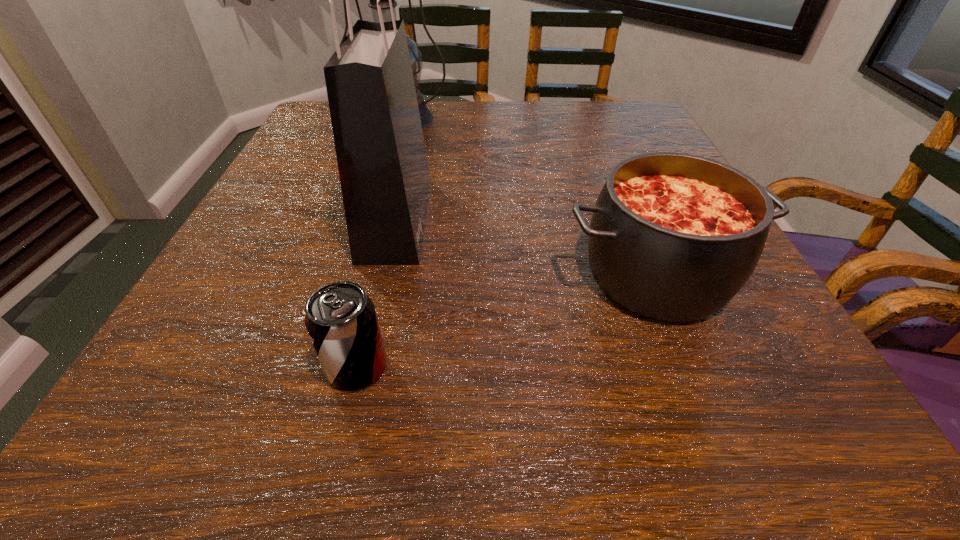
At what (x,y) coordinates should I click in order to perform the action: click on object that is at the far edge. Please return your answer as a coordinate pair (x, y). Image resolution: width=960 pixels, height=540 pixels. Looking at the image, I should click on (426, 116).

Identify the location of object that is at the near edge. This screenshot has width=960, height=540. (341, 320).

Identify the location of object at the left edge. (426, 116).

Where is `object that is at the right edge`? The image size is (960, 540). object that is at the right edge is located at coordinates (673, 236).

This screenshot has width=960, height=540. What are the coordinates of `object situated at the far left corner` in the screenshot? It's located at (426, 116).

This screenshot has width=960, height=540. I want to click on vacant space at the far edge of the desktop, so click(466, 118).

Where is `vacant space at the near edge of the desktop`? This screenshot has width=960, height=540. vacant space at the near edge of the desktop is located at coordinates (456, 434).

Identify the location of free space at the left edge of the desktop. This screenshot has width=960, height=540. (217, 309).

I want to click on free space at the right edge, so click(744, 364).

The image size is (960, 540). Find the location of `vacant space at the far right corner`. vacant space at the far right corner is located at coordinates (644, 142).